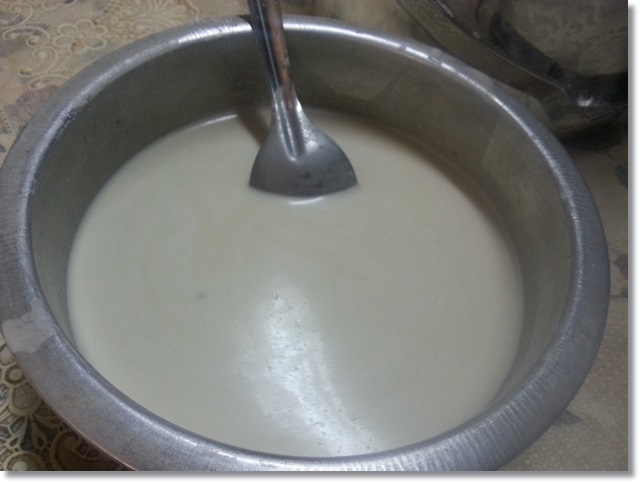
Locate an element on the screen. The image size is (640, 483). table is located at coordinates (566, 445), (614, 383), (618, 214).